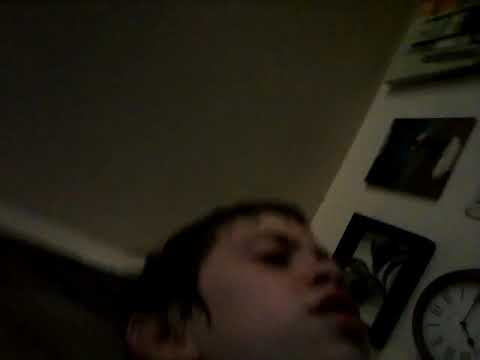
The width and height of the screenshot is (480, 360). Identify the location of artwork. (369, 268), (395, 161), (440, 32).